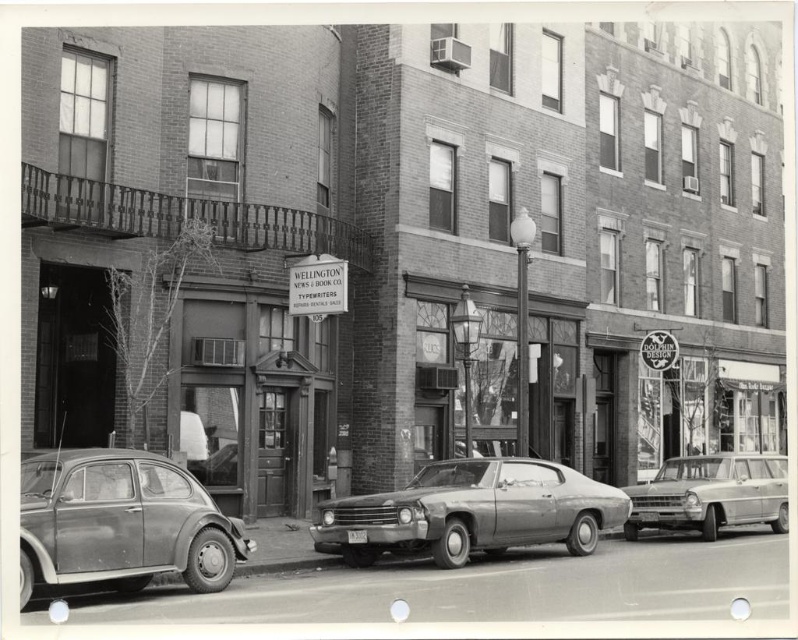
Can you confirm if matte gray car at lower left is positioned above metallic gray sedan at center?

Correct, matte gray car at lower left is located above metallic gray sedan at center.

The height and width of the screenshot is (640, 798). Describe the element at coordinates (121, 522) in the screenshot. I see `matte gray car at lower left` at that location.

Which is in front, point (74, 547) or point (322, 538)?

Point (74, 547) is in front.

Image resolution: width=798 pixels, height=640 pixels. I want to click on matte gray car at lower left, so click(x=121, y=522).

Which of these two, matte gray car at lower left or metallic silver station wagon at center, stands taller?

With more height is matte gray car at lower left.

Can you confirm if matte gray car at lower left is positioned to the left of metallic silver station wagon at center?

Yes, matte gray car at lower left is to the left of metallic silver station wagon at center.

Find the location of a particular element. Image resolution: width=798 pixels, height=640 pixels. matte gray car at lower left is located at coordinates (121, 522).

This screenshot has height=640, width=798. I want to click on matte gray car at lower left, so click(121, 522).

Is metallic gray sedan at center closer to the viewer compared to metallic silver station wagon at center?

Yes, metallic gray sedan at center is closer to the viewer.

Measure the distance between metallic gray sedan at center and metallic silver station wagon at center.

metallic gray sedan at center and metallic silver station wagon at center are 4.78 meters apart.

Image resolution: width=798 pixels, height=640 pixels. I want to click on metallic gray sedan at center, so click(x=471, y=513).